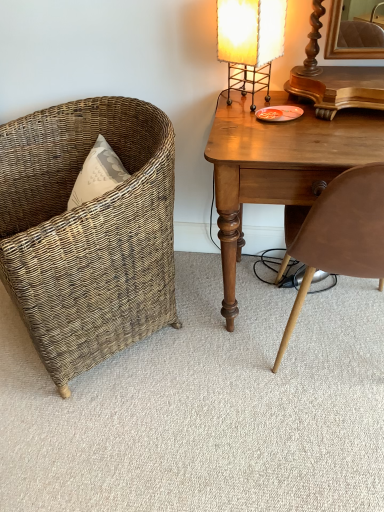
Question: Does woven brown chair at left, which is the 2th chair from right to left, have a lesser width compared to brown leather chair at right, the first chair when ordered from right to left?

Choices:
 (A) yes
 (B) no

Answer: (B)

Question: Is woven brown chair at left, which is counted as the first chair, starting from the left, at the right side of brown leather chair at right, the 2th chair in the left-to-right sequence?

Choices:
 (A) yes
 (B) no

Answer: (B)

Question: Can you confirm if woven brown chair at left, which is the 2th chair from right to left, is positioned to the left of brown leather chair at right, the first chair when ordered from right to left?

Choices:
 (A) yes
 (B) no

Answer: (A)

Question: Considering the relative sizes of woven brown chair at left, which is counted as the first chair, starting from the left, and brown leather chair at right, the first chair when ordered from right to left, in the image provided, is woven brown chair at left, which is counted as the first chair, starting from the left, wider than brown leather chair at right, the first chair when ordered from right to left,?

Choices:
 (A) yes
 (B) no

Answer: (A)

Question: Does woven brown chair at left, which is counted as the first chair, starting from the left, come behind brown leather chair at right, the 2th chair in the left-to-right sequence?

Choices:
 (A) yes
 (B) no

Answer: (A)

Question: Choose the correct answer: Is wooden desk at right inside woven brown chair at left, which is counted as the first chair, starting from the left, or outside it?

Choices:
 (A) outside
 (B) inside

Answer: (A)

Question: Looking at their shapes, would you say wooden desk at right is wider or thinner than woven brown chair at left, which is counted as the first chair, starting from the left?

Choices:
 (A) thin
 (B) wide

Answer: (A)

Question: Relative to woven brown chair at left, which is counted as the first chair, starting from the left, is wooden desk at right in front or behind?

Choices:
 (A) front
 (B) behind

Answer: (B)

Question: Based on their positions, is wooden desk at right located to the left or right of woven brown chair at left, which is counted as the first chair, starting from the left?

Choices:
 (A) right
 (B) left

Answer: (A)

Question: Is woven wicker chair at left wider or thinner than woven brown chair at left, which is counted as the first chair, starting from the left?

Choices:
 (A) wide
 (B) thin

Answer: (A)

Question: Looking at the image, does woven wicker chair at left seem bigger or smaller compared to woven brown chair at left, which is counted as the first chair, starting from the left?

Choices:
 (A) big
 (B) small

Answer: (B)

Question: Relative to woven brown chair at left, which is the 2th chair from right to left, is woven wicker chair at left in front or behind?

Choices:
 (A) front
 (B) behind

Answer: (B)

Question: From the image's perspective, relative to woven brown chair at left, which is counted as the first chair, starting from the left, is woven wicker chair at left above or below?

Choices:
 (A) above
 (B) below

Answer: (B)

Question: From a real-world perspective, is woven brown chair at left, which is counted as the first chair, starting from the left, above or below brown leather chair at right, the 2th chair in the left-to-right sequence?

Choices:
 (A) above
 (B) below

Answer: (B)

Question: In terms of size, does woven brown chair at left, which is the 2th chair from right to left, appear bigger or smaller than brown leather chair at right, the 2th chair in the left-to-right sequence?

Choices:
 (A) small
 (B) big

Answer: (B)